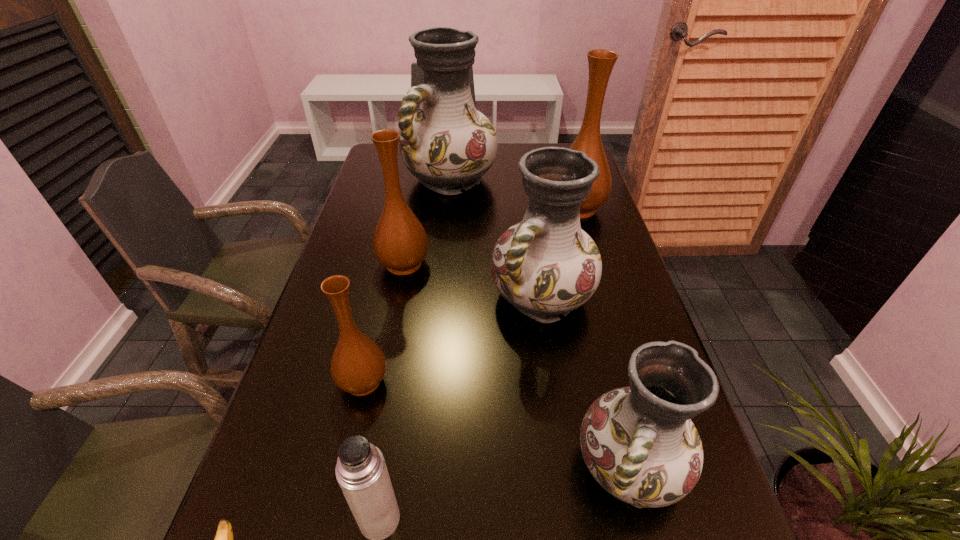
Where is `the seventh closest object relative to the biggest brown vase`? This screenshot has width=960, height=540. the seventh closest object relative to the biggest brown vase is located at coordinates (224, 539).

In order to click on the third closest object to the nearest vase in this screenshot , I will do `click(358, 365)`.

In order to click on vase that is the second closest to the farthest red vase in this screenshot , I will do `click(400, 242)`.

Locate an element on the screen. Image resolution: width=960 pixels, height=540 pixels. vase that stands as the fourth closest to the biggest brown vase is located at coordinates (639, 443).

The image size is (960, 540). What are the coordinates of `the second closest red vase to the nearest red vase` in the screenshot? It's located at (447, 144).

At what (x,y) coordinates should I click in order to perform the action: click on the closest red vase to the second biggest brown vase. Please return your answer as a coordinate pair (x, y). Looking at the image, I should click on (546, 265).

Identify which brown vase is located as the third nearest to the seventh tallest object. Please provide its 2D coordinates. Your answer should be formatted as a tuple, i.e. [(x, y)], where the tuple contains the x and y coordinates of a point satisfying the conditions above.

[(600, 62)]

At what (x,y) coordinates should I click in order to perform the action: click on the second closest brown vase to the smallest red vase. Please return your answer as a coordinate pair (x, y). Looking at the image, I should click on (400, 242).

You are a GUI agent. You are given a task and a screenshot of the screen. Output one action in this format:
    pyautogui.click(x=<x>, y=<y>)
    Task: Click on the vacant space that satisfies the following two spatial constraints: 1. on the front side of the second nearest brown vase; 2. on the right side of the second farthest red vase
    Image resolution: width=960 pixels, height=540 pixels.
    Given the screenshot: What is the action you would take?
    pyautogui.click(x=397, y=296)